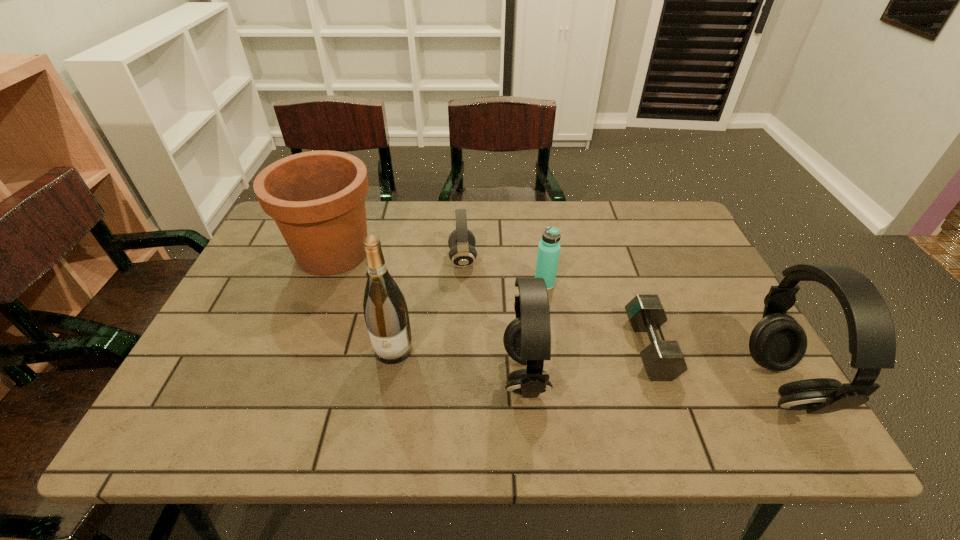
Identify the location of vacant region located 0.100m on the ear cups of the shorter earphone. (458, 374).

Where is `free space located 0.110m on the ear cups of the shorter earphone`? The height and width of the screenshot is (540, 960). free space located 0.110m on the ear cups of the shorter earphone is located at coordinates (453, 374).

I want to click on vacant space located 0.380m on the ear cups of the shorter earphone, so click(332, 374).

Identify the location of vacant space located on the ear cups of the right earphone. (684, 384).

Where is `vacant space positioned on the ear cups of the right earphone`? The height and width of the screenshot is (540, 960). vacant space positioned on the ear cups of the right earphone is located at coordinates (596, 384).

This screenshot has width=960, height=540. Find the location of `vacant space located on the ear cups of the right earphone`. vacant space located on the ear cups of the right earphone is located at coordinates (730, 384).

The image size is (960, 540). Find the location of `vacant space located 0.160m on the front of the thermos bottle`. vacant space located 0.160m on the front of the thermos bottle is located at coordinates (553, 338).

Find the location of a particular element. free location located on the back of the leftmost object is located at coordinates (350, 208).

Find the location of `vacant space located 0.380m on the ear cups of the fifth object from right to left`. vacant space located 0.380m on the ear cups of the fifth object from right to left is located at coordinates (610, 259).

Identify the location of vacant region located 0.050m on the label of the wine bottle. (387, 384).